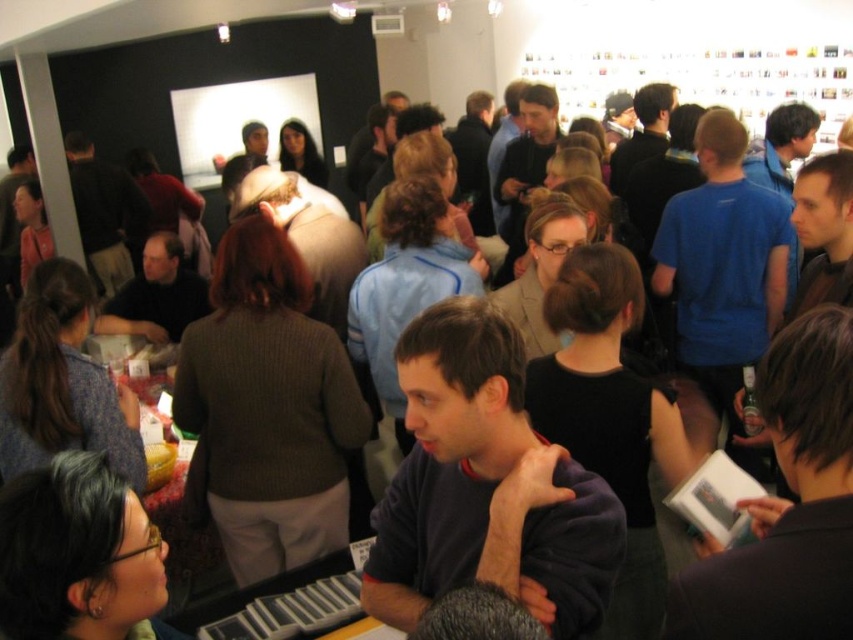
Question: Estimate the real-world distances between objects in this image. Which object is farther from the smooth beige shirt at center?

Choices:
 (A) dark blue fleece at center
 (B) dark brown sweater at center

Answer: (B)

Question: Is dark brown sweater at center bigger than dark gray sweater at center?

Choices:
 (A) yes
 (B) no

Answer: (A)

Question: Can you confirm if smooth beige shirt at center is positioned to the right of dark gray sweater at center?

Choices:
 (A) no
 (B) yes

Answer: (B)

Question: Does dark brown sweater at center lie behind blue cotton shirt at upper right?

Choices:
 (A) yes
 (B) no

Answer: (A)

Question: Which object is closer to the camera taking this photo?

Choices:
 (A) smooth beige shirt at center
 (B) blue cotton shirt at upper right

Answer: (B)

Question: Which point is farther to the camera?

Choices:
 (A) blue cotton shirt at upper right
 (B) dark brown leather jacket at center

Answer: (A)